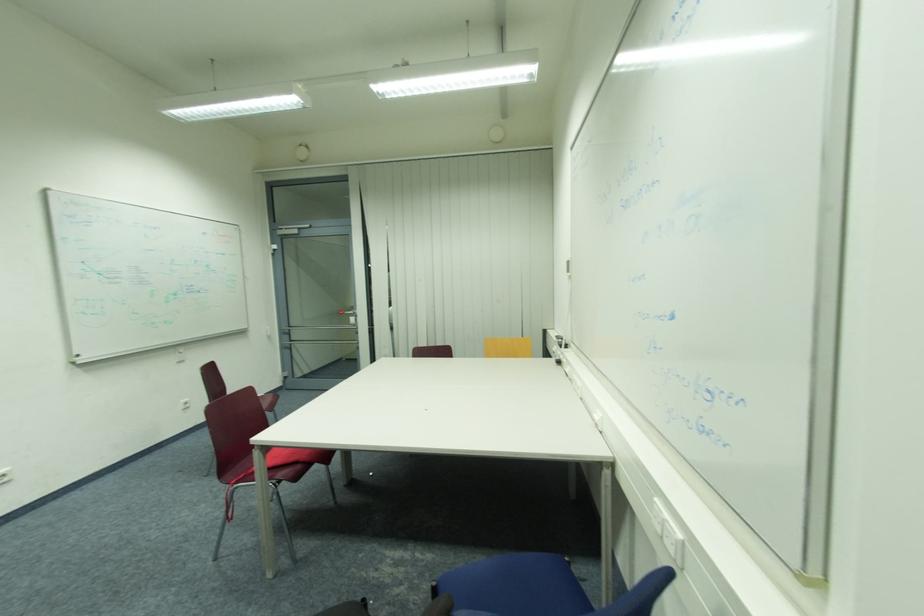
Where is `blue chair sitting surface`? This screenshot has width=924, height=616. blue chair sitting surface is located at coordinates (515, 585).